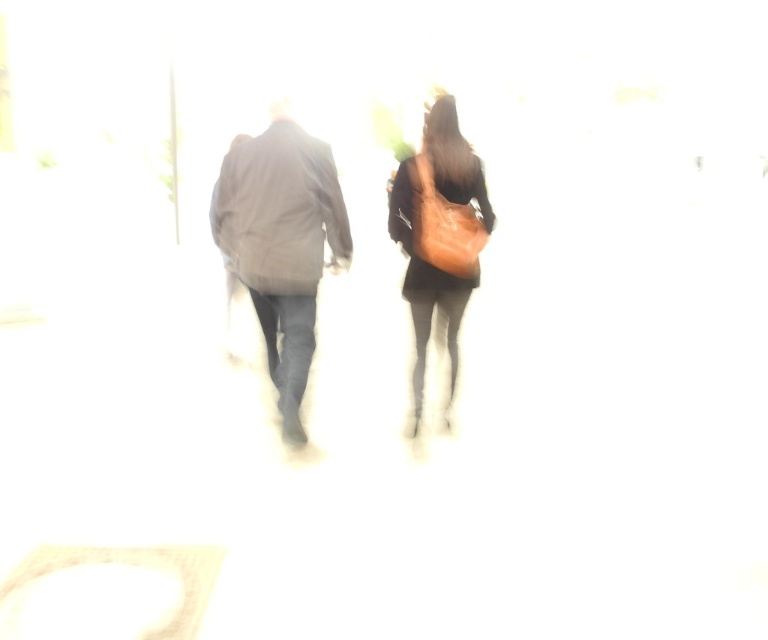
You are a photographer trying to adjust the focus of your camera. You notice two points in the image at coordinates point (444, 150) and point (290, 317). According to the scene description, which point should you focus on first to ensure the person in front is sharp?

Point (444, 150) is in front of point (290, 317), so you should focus on point (444, 150) first to capture the person in front more sharply.

You are a photographer trying to adjust your camera settings to capture a clearer image of the matte orange bag at right and the leather brown bag at center. Based on their positions, which bag is closer to the left side of the frame?

The matte orange bag at right is to the left of the leather brown bag at center, so it is closer to the left side of the frame.